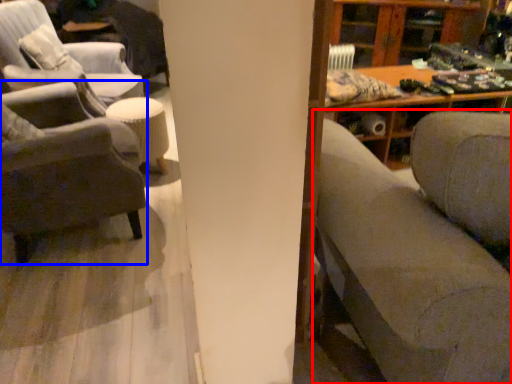
Question: Which object is further to the camera taking this photo, studio couch (highlighted by a red box) or chair (highlighted by a blue box)?

Choices:
 (A) studio couch
 (B) chair

Answer: (B)